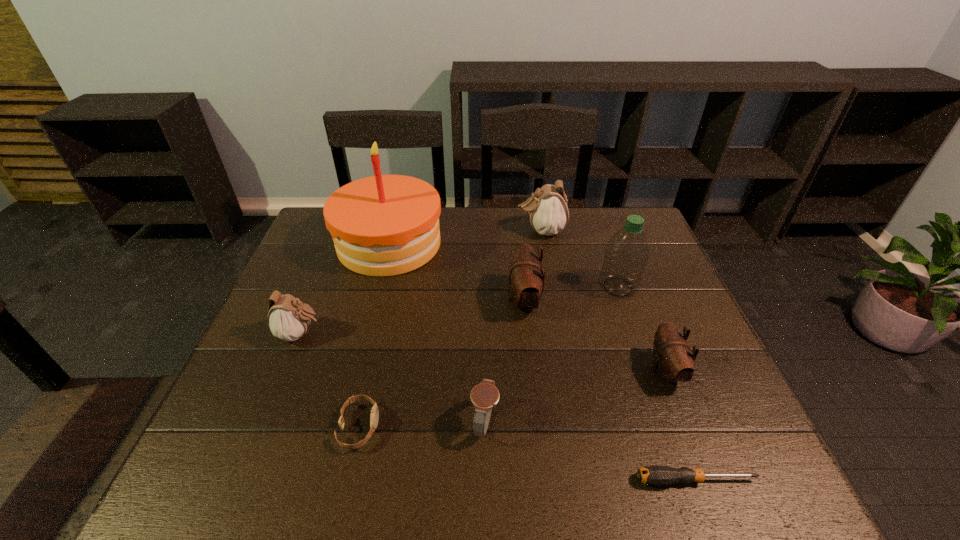
Identify which object is the third closest to the farther white pouch. Please provide its 2D coordinates. Your answer should be formatted as a tuple, i.e. [(x, y)], where the tuple contains the x and y coordinates of a point satisfying the conditions above.

[(384, 225)]

Image resolution: width=960 pixels, height=540 pixels. In order to click on pouch that is the second closest to the leftmost pouch in this screenshot , I will do `click(548, 210)`.

Locate an element on the screen. This screenshot has height=540, width=960. the third closest pouch to the farther brown pouch is located at coordinates click(288, 318).

This screenshot has width=960, height=540. I want to click on free location that satisfies the following two spatial constraints: 1. on the front side of the green water bottle; 2. on the front-facing side of the nearer white pouch, so click(x=635, y=334).

Identify the location of free location that satisfies the following two spatial constraints: 1. on the front side of the second tallest object; 2. with the flap open on the bigger brown pouch. (622, 300).

Where is `free location that satisfies the following two spatial constraints: 1. on the front-facing side of the left white pouch; 2. on the back side of the seventh tallest object`? The height and width of the screenshot is (540, 960). free location that satisfies the following two spatial constraints: 1. on the front-facing side of the left white pouch; 2. on the back side of the seventh tallest object is located at coordinates (264, 422).

Find the location of a particular element. Image resolution: width=960 pixels, height=540 pixels. vacant point that satisfies the following two spatial constraints: 1. on the front-facing side of the bigger white pouch; 2. on the back side of the water bottle is located at coordinates (551, 287).